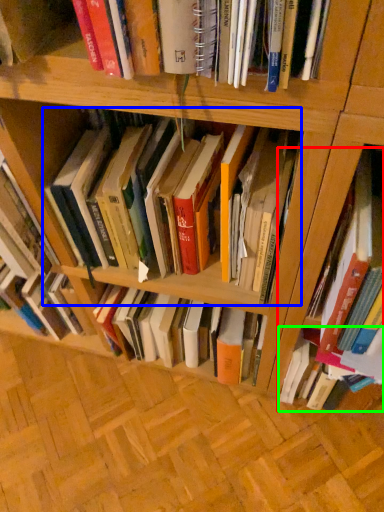
Question: Based on their relative distances, which object is nearer to book (highlighted by a red box)? Choose from book (highlighted by a blue box) and book (highlighted by a green box).

Choices:
 (A) book
 (B) book

Answer: (B)